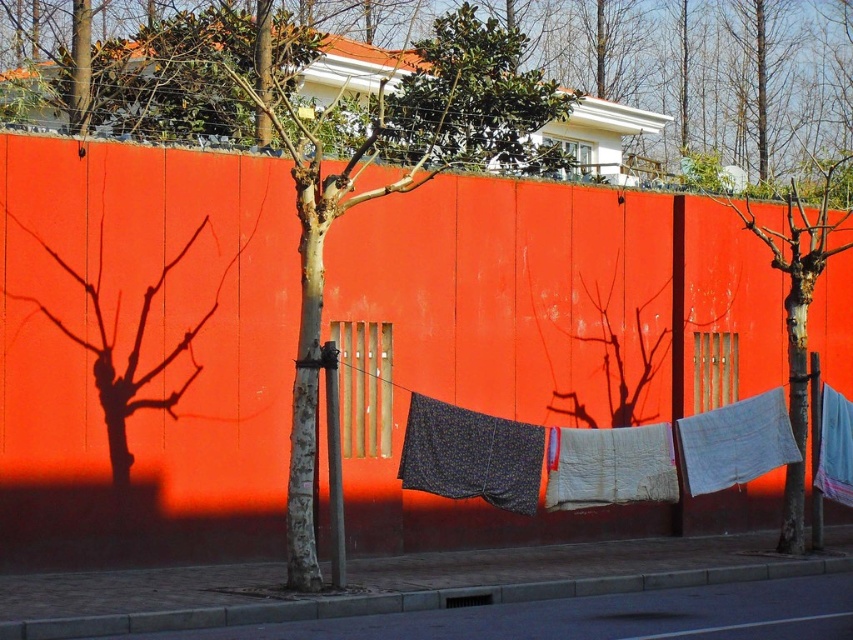
You are an artist planning to hang a light blue cotton cloth at center right on the wall. Considering the height of the bare wood tree at center, will the cloth be visible above the tree when viewed from the front?

The bare wood tree at center is taller than the light blue cotton cloth at center right, so the cloth will not be visible above the tree when viewed from the front.

You are standing in front of the red wall and notice two points marked on it. The first point is at coordinates point [799,381] and the second is at point [746,426]. Which point is closer to your eyes?

Point [799,381] is further to the camera than point [746,426], so the point closer to your eyes is point [746,426].